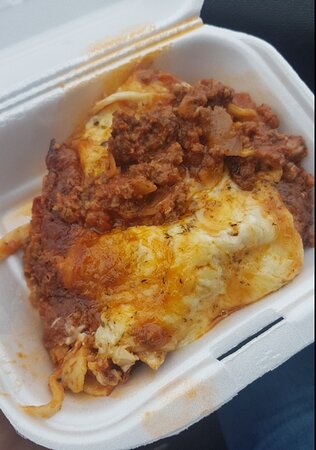
This screenshot has height=450, width=316. I want to click on empty space at top right corner, so click(x=312, y=3).